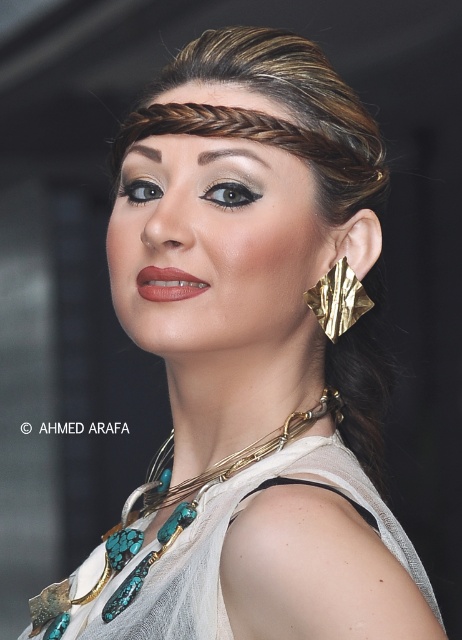
Question: Which point is farther to the camera?

Choices:
 (A) turquoise/glass necklace at shoulder
 (B) matte pink lips at center
 (C) gold textured leaf at ear

Answer: (C)

Question: Can you confirm if turquoise/glass necklace at shoulder is positioned below gold textured leaf at ear?

Choices:
 (A) no
 (B) yes

Answer: (B)

Question: Which point is closer to the camera taking this photo?

Choices:
 (A) (164, 499)
 (B) (334, 296)

Answer: (B)

Question: Where is gold textured leaf at ear located in relation to matte pink lips at center in the image?

Choices:
 (A) below
 (B) above

Answer: (A)

Question: In this image, where is turquoise/glass necklace at shoulder located relative to matte pink lips at center?

Choices:
 (A) left
 (B) right

Answer: (B)

Question: Which point is farther to the camera?

Choices:
 (A) matte pink lips at center
 (B) turquoise/glass necklace at shoulder

Answer: (B)